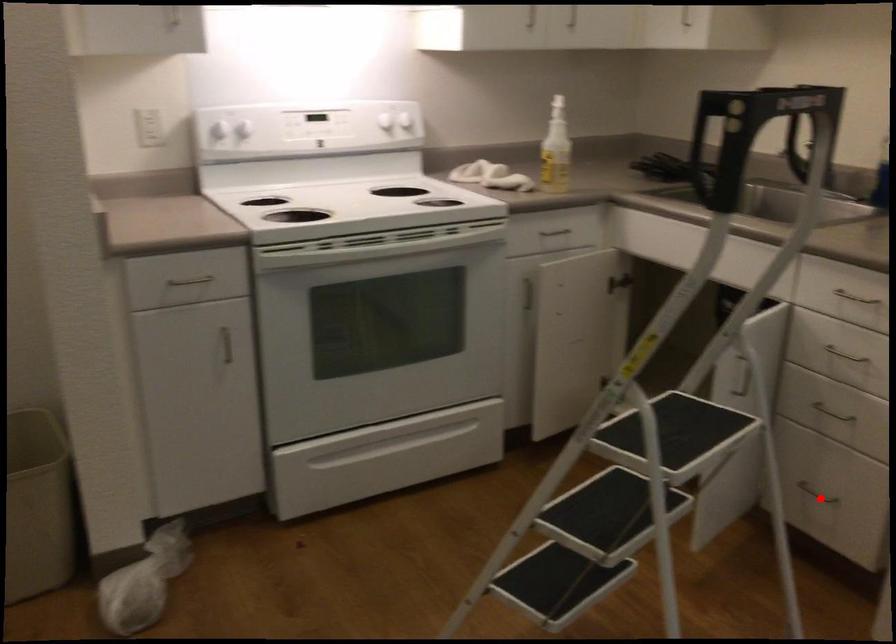
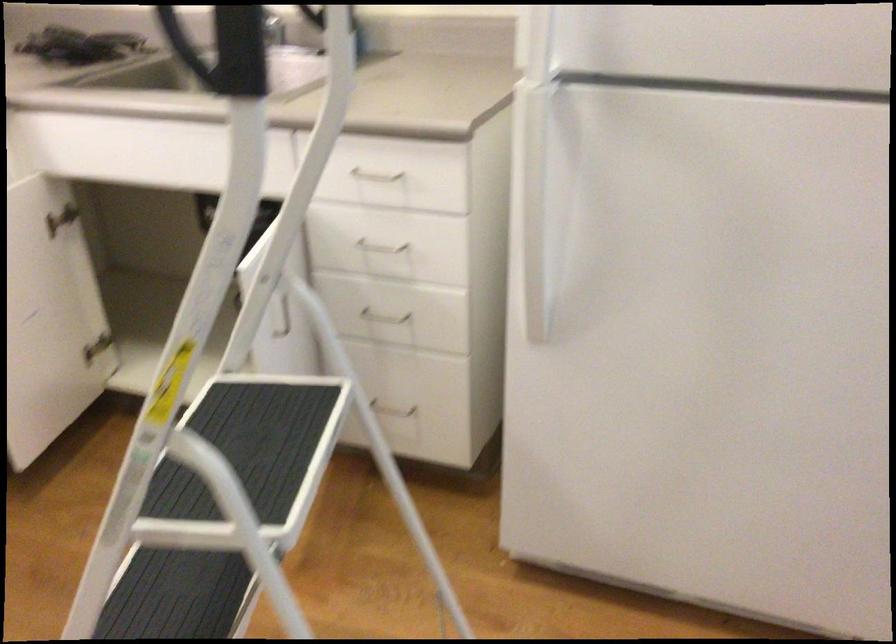
Locate, in the second image, the point that corresponds to the highlighted location in the first image.

(393, 413)